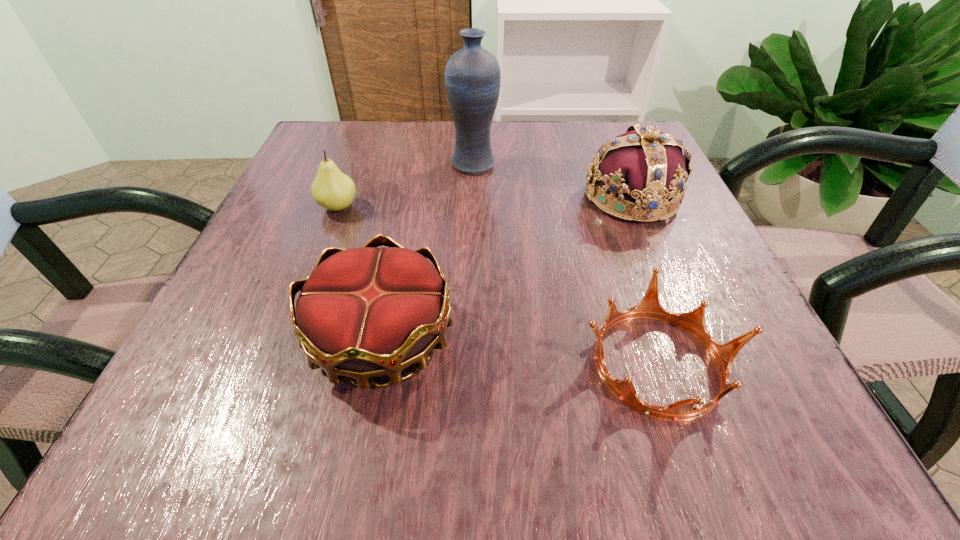
At what (x,y) coordinates should I click in order to perform the action: click on vacant region located 0.260m on the left of the shortest object. Please return your answer as a coordinate pair (x, y). The image size is (960, 540). Looking at the image, I should click on (377, 364).

You are a GUI agent. You are given a task and a screenshot of the screen. Output one action in this format:
    pyautogui.click(x=<x>, y=<y>)
    Task: Click on the vase positioned at the far edge
    The height and width of the screenshot is (540, 960).
    Given the screenshot: What is the action you would take?
    pyautogui.click(x=472, y=76)

Where is `crown that is at the far edge`? Image resolution: width=960 pixels, height=540 pixels. crown that is at the far edge is located at coordinates (644, 165).

Locate an element on the screen. Image resolution: width=960 pixels, height=540 pixels. pear that is positioned at the left edge is located at coordinates (333, 190).

The height and width of the screenshot is (540, 960). What are the coordinates of `crown located in the left edge section of the desktop` in the screenshot? It's located at pos(366,312).

The height and width of the screenshot is (540, 960). I want to click on object at the near left corner, so [366, 312].

Locate an element on the screen. This screenshot has height=540, width=960. object that is at the far right corner is located at coordinates (644, 165).

Where is `object present at the near right corner`? The image size is (960, 540). object present at the near right corner is located at coordinates (693, 322).

At what (x,y) coordinates should I click in order to perform the action: click on blank area at the far edge. Please return your answer as a coordinate pair (x, y). Looking at the image, I should click on (402, 127).

The width and height of the screenshot is (960, 540). In the image, there is a desktop. Find the location of `free space at the near edge`. free space at the near edge is located at coordinates (444, 409).